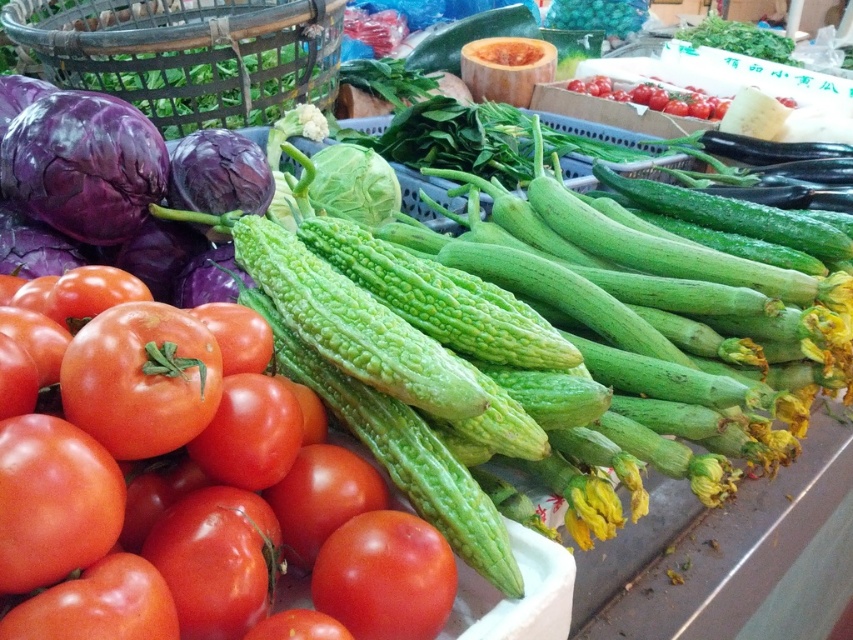
You are a customer at the market stall and want to pick up the red matte tomato at center and the red matte tomatoes at upper right. Which one is located to the left of the other?

The red matte tomato at center is positioned on the left side of red matte tomatoes at upper right, so the red matte tomato at center is to the left of the red matte tomatoes at upper right.

You are a customer at the market stall and want to pick up the red matte tomato at center. Can you reach it without moving the red matte tomatoes at upper right?

The red matte tomato at center is in front of red matte tomatoes at upper right, so you can reach it without moving the red matte tomatoes at upper right.